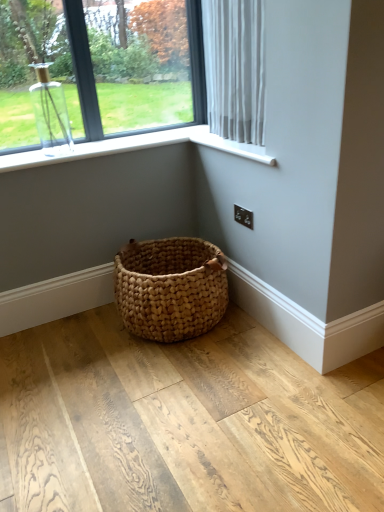
Question: Is clear glass vase at upper left aimed at white sheer curtain at upper right?

Choices:
 (A) yes
 (B) no

Answer: (A)

Question: From the image's perspective, would you say clear glass vase at upper left is positioned over white sheer curtain at upper right?

Choices:
 (A) no
 (B) yes

Answer: (B)

Question: Considering the relative positions of clear glass vase at upper left and white sheer curtain at upper right in the image provided, is clear glass vase at upper left to the left of white sheer curtain at upper right from the viewer's perspective?

Choices:
 (A) yes
 (B) no

Answer: (A)

Question: Considering the relative sizes of clear glass vase at upper left and white sheer curtain at upper right in the image provided, is clear glass vase at upper left shorter than white sheer curtain at upper right?

Choices:
 (A) yes
 (B) no

Answer: (A)

Question: Is white sheer curtain at upper right located within clear glass vase at upper left?

Choices:
 (A) no
 (B) yes

Answer: (A)

Question: Is point (215, 53) closer or farther from the camera than point (238, 145)?

Choices:
 (A) closer
 (B) farther

Answer: (B)

Question: Do you think white sheer curtain at upper right is within white plastic window sill at upper right, or outside of it?

Choices:
 (A) inside
 (B) outside

Answer: (B)

Question: Is white sheer curtain at upper right to the left or to the right of white plastic window sill at upper right in the image?

Choices:
 (A) left
 (B) right

Answer: (A)

Question: In the image, is white sheer curtain at upper right positioned in front of or behind white plastic window sill at upper right?

Choices:
 (A) behind
 (B) front

Answer: (B)

Question: Is clear glass vase at upper left inside the boundaries of white sheer curtain at upper right, or outside?

Choices:
 (A) inside
 (B) outside

Answer: (B)

Question: Visually, is clear glass vase at upper left positioned to the left or to the right of white sheer curtain at upper right?

Choices:
 (A) right
 (B) left

Answer: (B)

Question: Looking at the image, does clear glass vase at upper left seem bigger or smaller compared to white sheer curtain at upper right?

Choices:
 (A) small
 (B) big

Answer: (A)

Question: Is point (6, 91) positioned closer to the camera than point (253, 69)?

Choices:
 (A) farther
 (B) closer

Answer: (A)

Question: In the image, is white sheer curtain at upper right on the left side or the right side of clear glass vase at upper left?

Choices:
 (A) left
 (B) right

Answer: (B)

Question: From the image's perspective, is white sheer curtain at upper right above or below clear glass vase at upper left?

Choices:
 (A) below
 (B) above

Answer: (A)